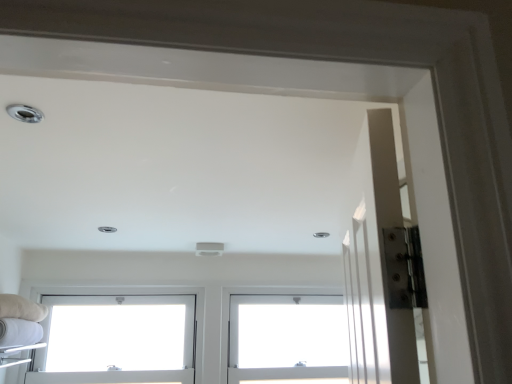
Question: Would you say white plastic window at center, which appears as the second window when viewed from the left, is inside or outside white plastic window at lower left, which appears as the second window when viewed from the right?

Choices:
 (A) inside
 (B) outside

Answer: (B)

Question: Would you say white plastic window at center, which appears as the second window when viewed from the left, is to the left or to the right of white plastic window at lower left, the 1th window from the left, in the picture?

Choices:
 (A) left
 (B) right

Answer: (B)

Question: In terms of width, does white plastic window at center, the first window viewed from the right, look wider or thinner when compared to white plastic window at lower left, which appears as the second window when viewed from the right?

Choices:
 (A) wide
 (B) thin

Answer: (A)

Question: In the image, is white plastic window at lower left, which appears as the second window when viewed from the right, positioned in front of or behind white plastic window at center, which appears as the second window when viewed from the left?

Choices:
 (A) front
 (B) behind

Answer: (A)

Question: From a real-world perspective, relative to white plastic window at center, the first window viewed from the right, is white plastic window at lower left, the 1th window from the left, vertically above or below?

Choices:
 (A) above
 (B) below

Answer: (A)

Question: Is white plastic window at lower left, the 1th window from the left, situated inside white plastic window at center, which appears as the second window when viewed from the left, or outside?

Choices:
 (A) outside
 (B) inside

Answer: (A)

Question: Considering the positions of white plastic window at lower left, the 1th window from the left, and white plastic window at center, the first window viewed from the right, in the image, is white plastic window at lower left, the 1th window from the left, bigger or smaller than white plastic window at center, the first window viewed from the right,?

Choices:
 (A) small
 (B) big

Answer: (B)